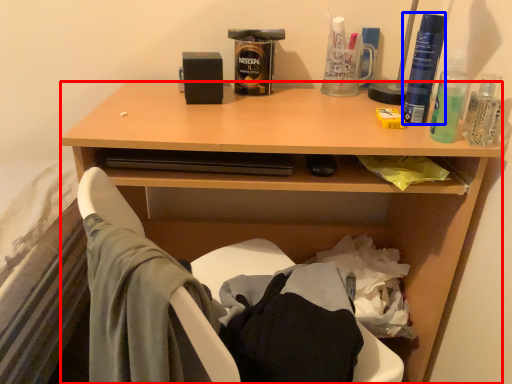
Question: Which point is further to the camera, desk (highlighted by a red box) or bottle (highlighted by a blue box)?

Choices:
 (A) desk
 (B) bottle

Answer: (B)